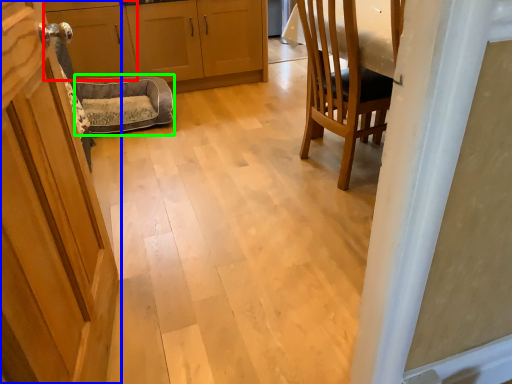
Question: Which is nearer to the cabinetry (highlighted by a red box)? door (highlighted by a blue box) or dog bed (highlighted by a green box).

Choices:
 (A) door
 (B) dog bed

Answer: (B)